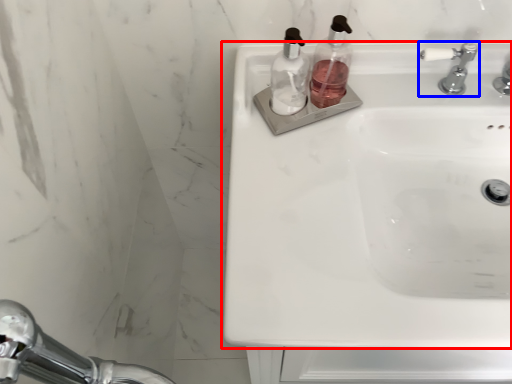
Question: Which of the following is the farthest to the observer, sink (highlighted by a red box) or tap (highlighted by a blue box)?

Choices:
 (A) sink
 (B) tap

Answer: (B)